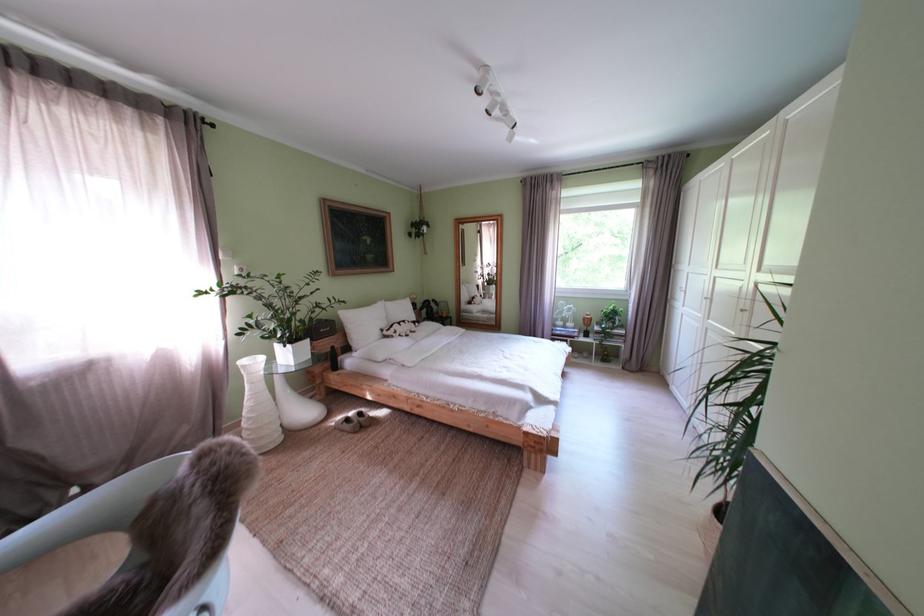
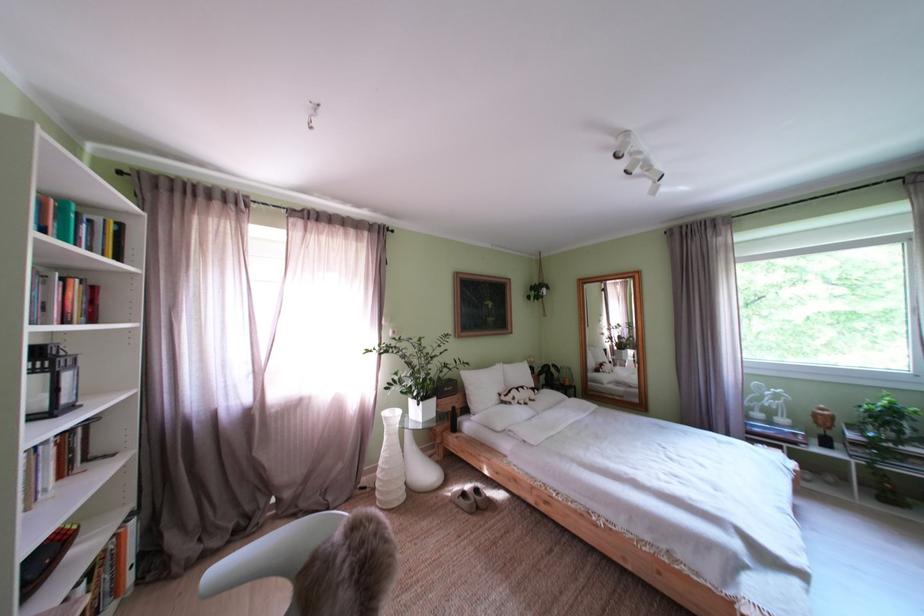
The point at (424, 336) is marked in the first image. Where is the corresponding point in the second image?

(543, 403)